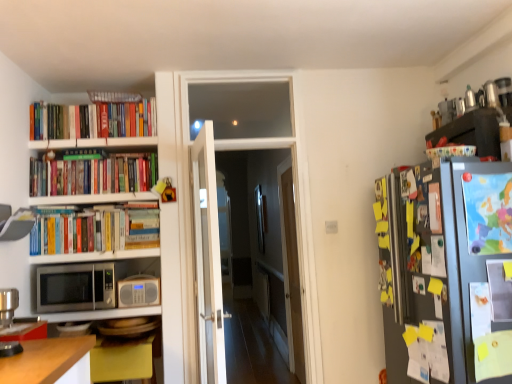
Where is `vacant region below hardcover books at upper left, acting as the second book starting from the bottom (from a real-world perspective)`? vacant region below hardcover books at upper left, acting as the second book starting from the bottom (from a real-world perspective) is located at coordinates (96, 190).